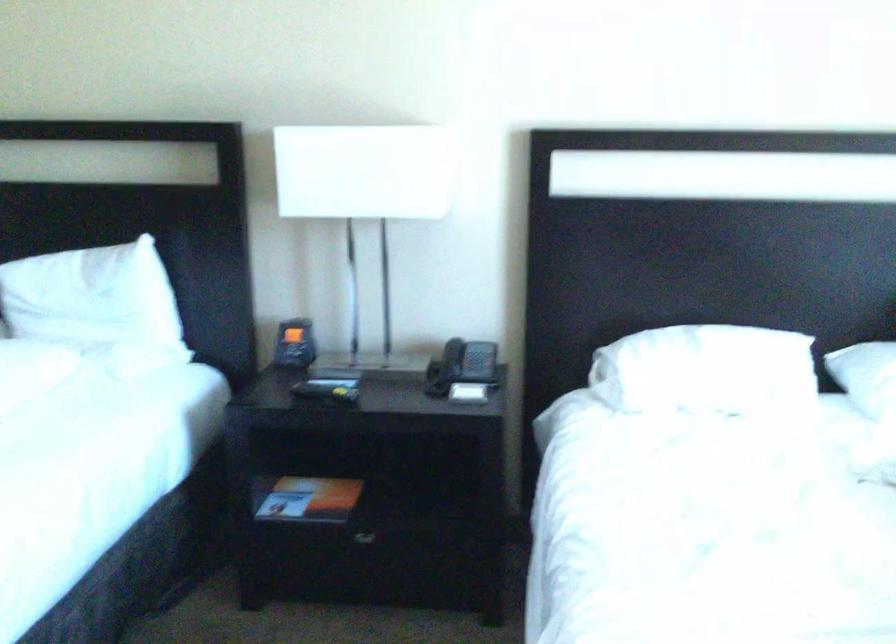
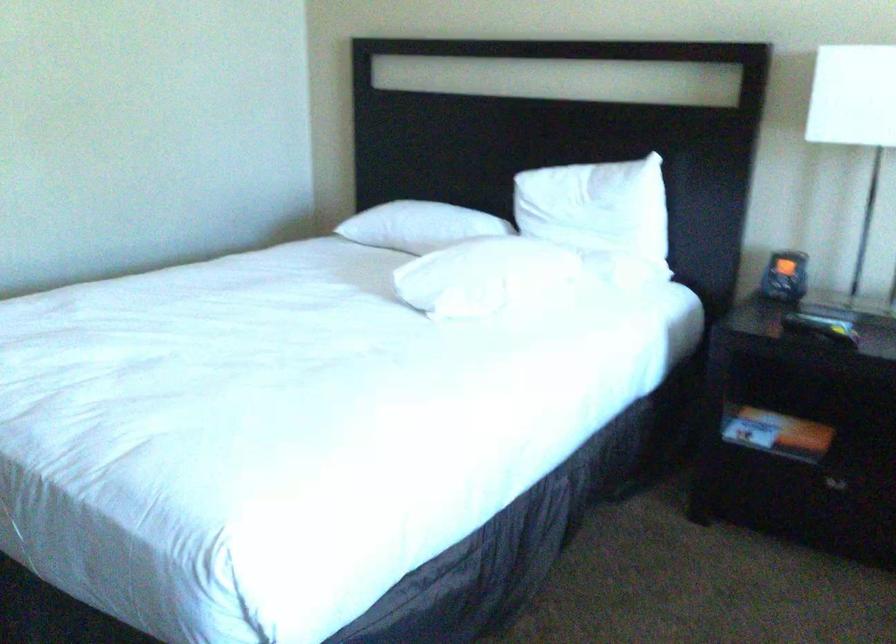
Which direction would the cameraman need to move to produce the second image?

The movement direction of the cameraman is left, backward.